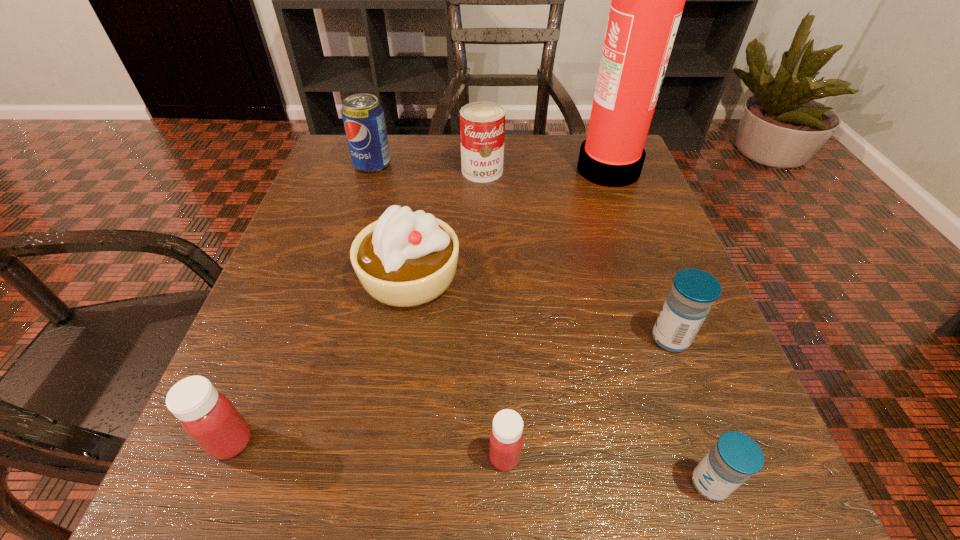
Identify the location of object located in the far left corner section of the desktop. (363, 116).

Find the location of a particular element. object positioned at the near left corner is located at coordinates (208, 417).

The width and height of the screenshot is (960, 540). What are the coordinates of `object located at the far right corner` in the screenshot? It's located at (647, 2).

Locate an element on the screen. object at the near right corner is located at coordinates coord(735,457).

Where is `vacant space at the far edge of the desktop`? vacant space at the far edge of the desktop is located at coordinates (455, 140).

In the image, there is a desktop. Where is `vacant space at the near edge`? The height and width of the screenshot is (540, 960). vacant space at the near edge is located at coordinates (578, 483).

The height and width of the screenshot is (540, 960). I want to click on vacant space at the left edge, so click(249, 360).

This screenshot has height=540, width=960. In the image, there is a desktop. In order to click on vacant area at the right edge in this screenshot , I will do `click(657, 312)`.

The height and width of the screenshot is (540, 960). In order to click on free space at the far left corner of the desktop in this screenshot , I will do `click(342, 154)`.

Find the location of `vacant space at the near right corner`. vacant space at the near right corner is located at coordinates (712, 512).